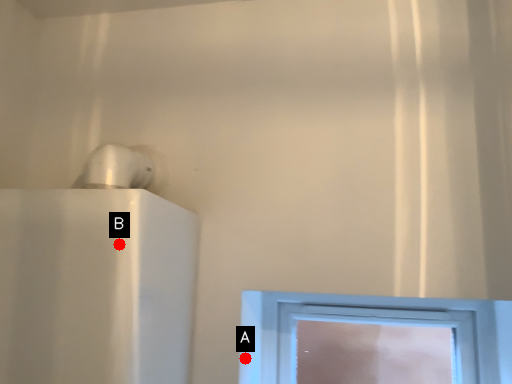
Question: Two points are circled on the image, labeled by A and B beside each circle. Which point is closer to the camera?

Choices:
 (A) A is closer
 (B) B is closer

Answer: (B)